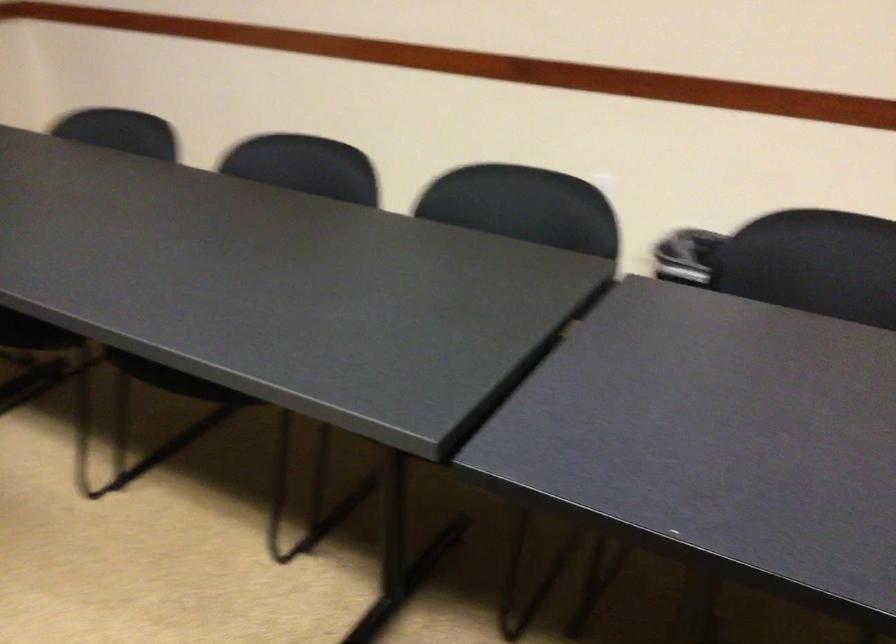
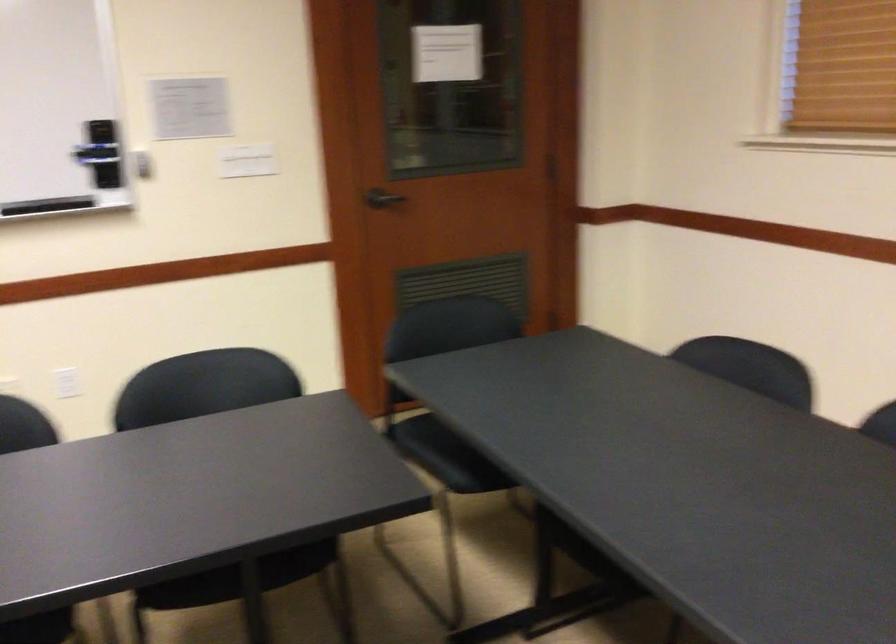
Question: The images are taken continuously from a first-person perspective. In which direction is your viewpoint rotating?

Choices:
 (A) Left
 (B) Right
 (C) Up
 (D) Down

Answer: (A)